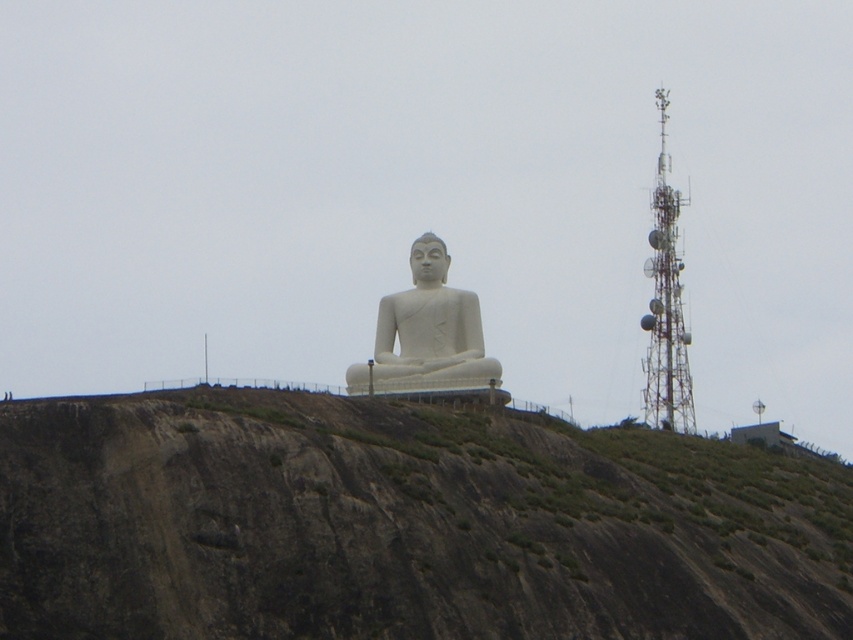
Question: Which object is farther from the camera taking this photo?

Choices:
 (A) white marble statue at center
 (B) brown rocky hillside at center

Answer: (A)

Question: Which of the following is the closest to the observer?

Choices:
 (A) [447, 262]
 (B) [129, 541]

Answer: (B)

Question: Considering the relative positions of brown rocky hillside at center and white marble statue at center in the image provided, where is brown rocky hillside at center located with respect to white marble statue at center?

Choices:
 (A) left
 (B) right

Answer: (B)

Question: Is brown rocky hillside at center bigger than white marble statue at center?

Choices:
 (A) no
 (B) yes

Answer: (B)

Question: Can you confirm if brown rocky hillside at center is smaller than white marble statue at center?

Choices:
 (A) yes
 (B) no

Answer: (B)